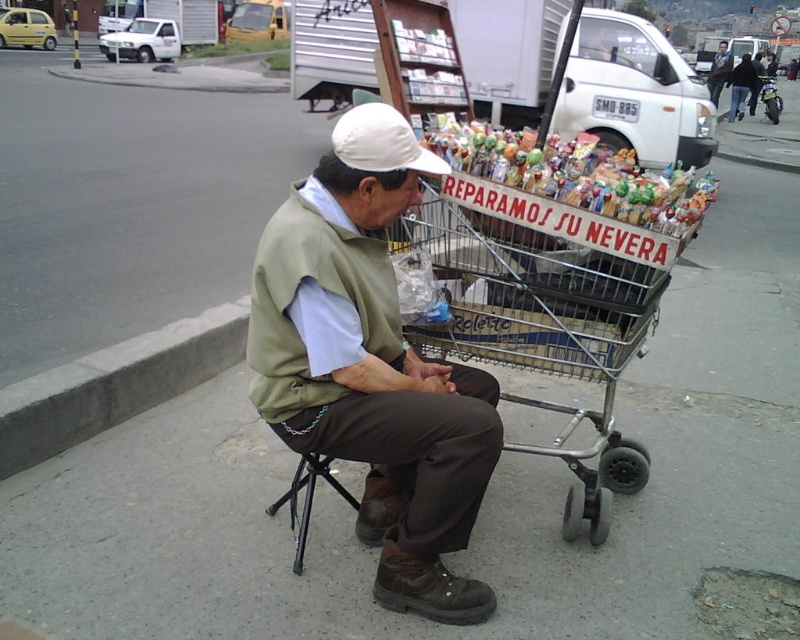
Can you confirm if concrete at lower left is smaller than translucent plastic candy at center?

No.

Is concrete at lower left further to camera compared to translucent plastic candy at center?

Yes, it is.

Locate an element on the screen. The height and width of the screenshot is (640, 800). concrete at lower left is located at coordinates point(114,385).

Who is higher up, white fabric baseball cap at center or dark blue jeans at lower center?

dark blue jeans at lower center is higher up.

Which is below, white fabric baseball cap at center or dark blue jeans at lower center?

white fabric baseball cap at center is lower down.

Between point (389, 134) and point (713, 67), which one is positioned behind?

The point (713, 67) is more distant.

Identify the location of white fabric baseball cap at center. This screenshot has height=640, width=800. (381, 141).

The image size is (800, 640). What are the coordinates of `matte green vest at center` in the screenshot? It's located at (372, 365).

Can you confirm if matte green vest at center is positioned to the right of metallic silver shopping cart at center?

No, matte green vest at center is not to the right of metallic silver shopping cart at center.

What do you see at coordinates (372, 365) in the screenshot? I see `matte green vest at center` at bounding box center [372, 365].

Identify the location of matte green vest at center. (372, 365).